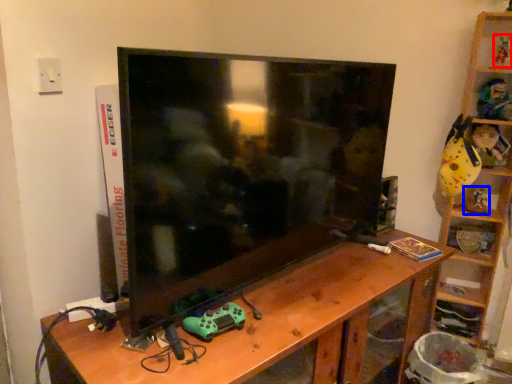
Question: Which object is closer to the camera taking this photo, toy (highlighted by a red box) or toy (highlighted by a blue box)?

Choices:
 (A) toy
 (B) toy

Answer: (A)